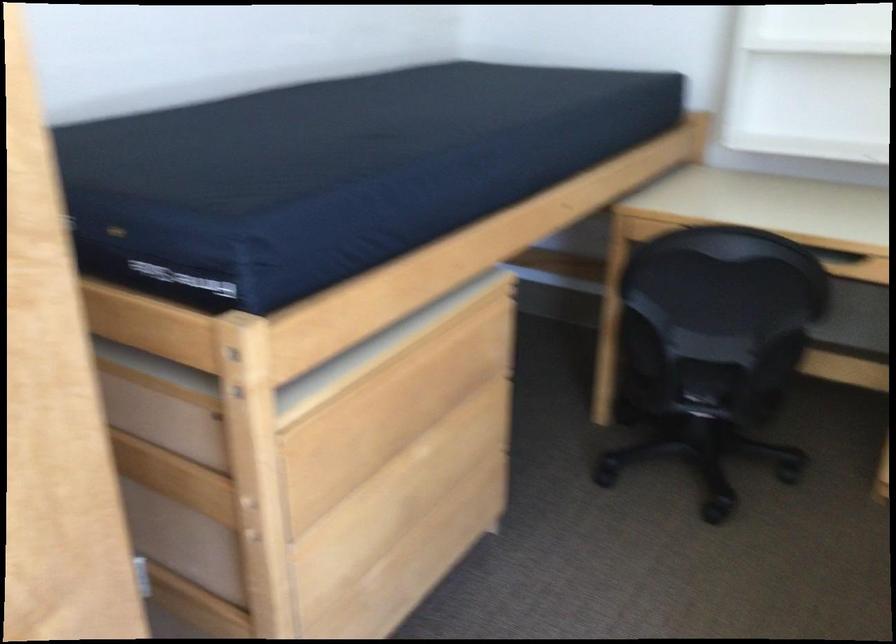
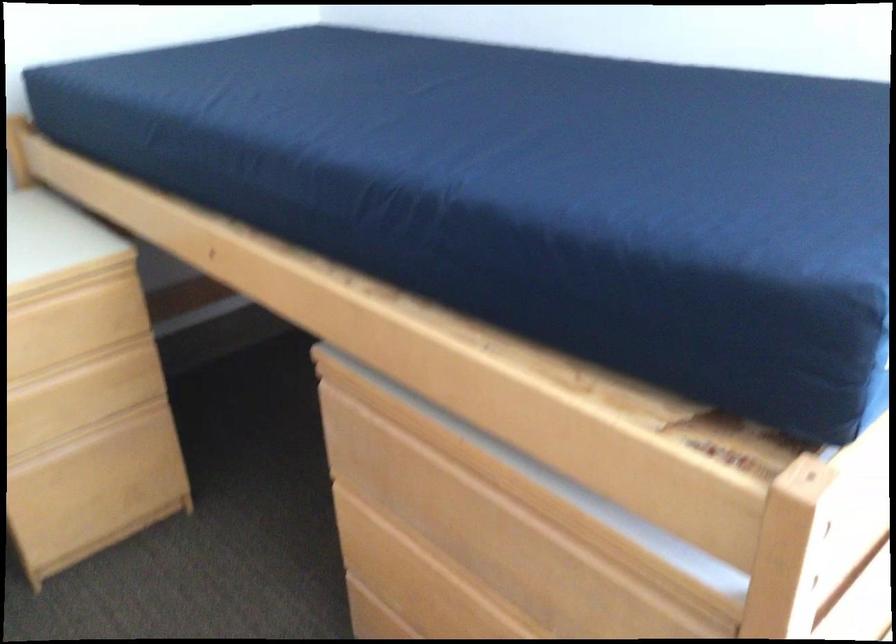
How did the camera likely rotate?

The rotation direction of the camera is right-down.